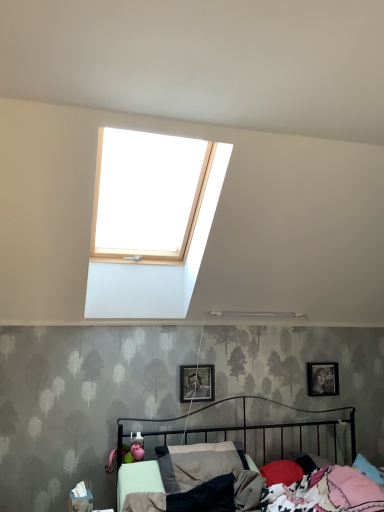
Question: In which direction should I rotate to look at metallic silver photo frame at center, the 1th picture frame when ordered from left to right?

Choices:
 (A) right
 (B) left

Answer: (A)

Question: Does metallic silver photo frame at right, placed as the first picture frame when sorted from right to left, have a greater width compared to metallic silver photo frame at center, the 1th picture frame from the front?

Choices:
 (A) yes
 (B) no

Answer: (B)

Question: Does metallic silver photo frame at right, the second picture frame when ordered from front to back, have a smaller size compared to metallic silver photo frame at center, the 2th picture frame when ordered from right to left?

Choices:
 (A) no
 (B) yes

Answer: (B)

Question: Is metallic silver photo frame at right, the second picture frame positioned from the left, located outside metallic silver photo frame at center, the 2th picture frame when ordered from right to left?

Choices:
 (A) no
 (B) yes

Answer: (B)

Question: Is metallic silver photo frame at right, the second picture frame when ordered from front to back, oriented away from metallic silver photo frame at center, which is counted as the second picture frame, starting from the back?

Choices:
 (A) no
 (B) yes

Answer: (A)

Question: From a real-world perspective, is metallic silver photo frame at right, placed as the first picture frame when sorted from right to left, beneath metallic silver photo frame at center, the 1th picture frame when ordered from left to right?

Choices:
 (A) yes
 (B) no

Answer: (B)

Question: From a real-world perspective, is metallic silver photo frame at right, which appears as the 1th picture frame when viewed from the back, physically above metallic silver photo frame at center, the 1th picture frame when ordered from left to right?

Choices:
 (A) yes
 (B) no

Answer: (A)

Question: From the image's perspective, is metallic silver photo frame at right, the second picture frame positioned from the left, below metallic black bed at lower center?

Choices:
 (A) no
 (B) yes

Answer: (A)

Question: Can you confirm if metallic silver photo frame at right, placed as the first picture frame when sorted from right to left, is smaller than metallic black bed at lower center?

Choices:
 (A) yes
 (B) no

Answer: (A)

Question: From a real-world perspective, is metallic silver photo frame at right, the second picture frame positioned from the left, on top of metallic black bed at lower center?

Choices:
 (A) no
 (B) yes

Answer: (B)

Question: Is metallic silver photo frame at right, the second picture frame when ordered from front to back, aimed at metallic black bed at lower center?

Choices:
 (A) no
 (B) yes

Answer: (A)

Question: Could metallic black bed at lower center be considered to be inside metallic silver photo frame at right, the second picture frame when ordered from front to back?

Choices:
 (A) no
 (B) yes

Answer: (A)

Question: Does metallic silver photo frame at right, the second picture frame positioned from the left, have a greater width compared to metallic black bed at lower center?

Choices:
 (A) yes
 (B) no

Answer: (B)

Question: Considering the relative positions of metallic silver photo frame at center, the 1th picture frame when ordered from left to right, and metallic black bed at lower center in the image provided, is metallic silver photo frame at center, the 1th picture frame when ordered from left to right, to the left of metallic black bed at lower center from the viewer's perspective?

Choices:
 (A) no
 (B) yes

Answer: (B)